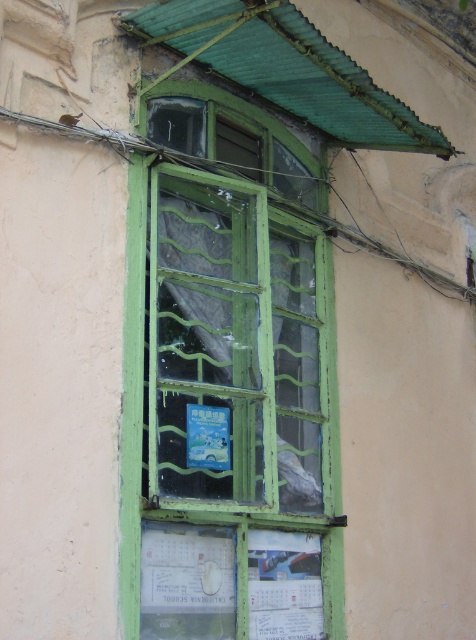
Question: Among these objects, which one is farthest from the camera?

Choices:
 (A) white paper calendar at lower center
 (B) green painted wood window frame at center

Answer: (A)

Question: Can you confirm if green painted wood window frame at center is positioned above white paper calendar at lower center?

Choices:
 (A) yes
 (B) no

Answer: (A)

Question: Can you confirm if green painted wood window frame at center is positioned to the right of white paper calendar at lower center?

Choices:
 (A) yes
 (B) no

Answer: (A)

Question: Is green painted wood window frame at center to the right of white paper calendar at lower center from the viewer's perspective?

Choices:
 (A) no
 (B) yes

Answer: (B)